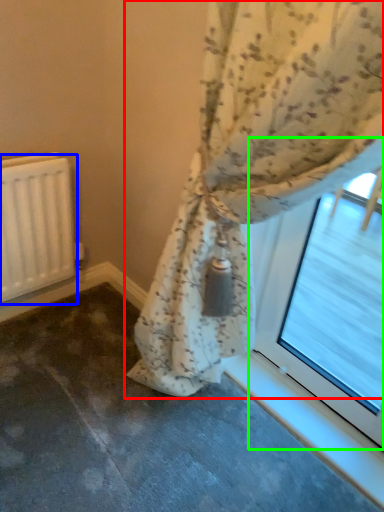
Question: Which object is positioned closest to curtain (highlighted by a red box)? Select from radiator (highlighted by a blue box) and bay window (highlighted by a green box).

Choices:
 (A) radiator
 (B) bay window

Answer: (B)